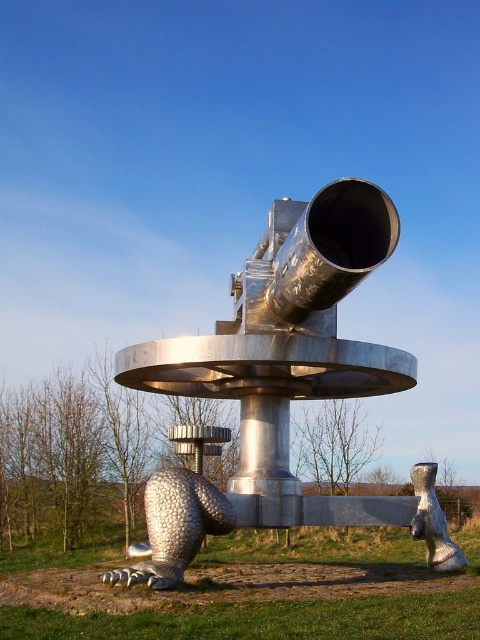
In the scene shown: You are an artist planning to paint this sculpture. You need to know which object is larger to decide where to focus more detail. Which is larger between the metallic silver telescope at center and the silver textured bear at lower left?

The silver textured bear at lower left is larger than the metallic silver telescope at center, so you should focus more detail on the silver textured bear at lower left.

Consider the image. You are standing in front of the sculpture and want to touch both the metallic silver telescope at center and the silver textured bear at lower left. Which object will you reach first?

The metallic silver telescope at center is closer to you than the silver textured bear at lower left, so you will reach the metallic silver telescope at center first.